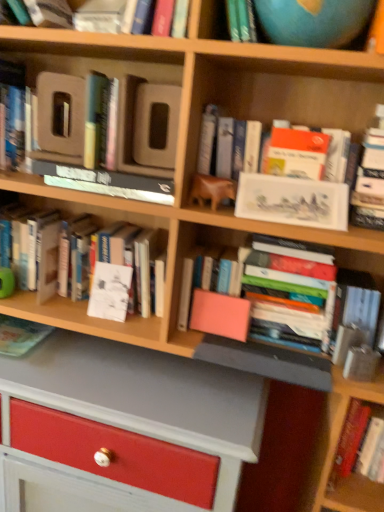
Question: Does hardcover book at lower right, the 1th book positioned from the bottom, have a smaller size compared to white paper at center, which is counted as the third paperback book, starting from the right?

Choices:
 (A) no
 (B) yes

Answer: (A)

Question: Is hardcover book at lower right, the 1th book positioned from the bottom, wider than white paper at center, arranged as the second paperback book when ordered from the bottom?

Choices:
 (A) yes
 (B) no

Answer: (A)

Question: Is the depth of hardcover book at lower right, which is counted as the 6th book, starting from the top, less than that of white paper at center, the 2th paperback book viewed from the top?

Choices:
 (A) yes
 (B) no

Answer: (A)

Question: From the image's perspective, would you say hardcover book at lower right, which is counted as the 6th book, starting from the top, is shown under white paper at center, arranged as the second paperback book when ordered from the bottom?

Choices:
 (A) no
 (B) yes

Answer: (B)

Question: Are hardcover book at lower right, the 1th book positioned from the bottom, and white paper at center, positioned as the 1th paperback book in back-to-front order, beside each other?

Choices:
 (A) yes
 (B) no

Answer: (B)

Question: In the image, is pink matte book at center, marked as the 3th paperback book in a top-to-bottom arrangement, positioned in front of or behind white glossy book at upper center, acting as the second book starting from the top?

Choices:
 (A) front
 (B) behind

Answer: (B)

Question: Is pink matte book at center, positioned as the second paperback book in front-to-back order, inside or outside of white glossy book at upper center, acting as the second book starting from the top?

Choices:
 (A) inside
 (B) outside

Answer: (B)

Question: From a real-world perspective, is pink matte book at center, the 2th paperback book in the left-to-right sequence, physically located above or below white glossy book at upper center, the 5th book when ordered from bottom to top?

Choices:
 (A) above
 (B) below

Answer: (B)

Question: In terms of height, does pink matte book at center, positioned as the second paperback book in front-to-back order, look taller or shorter compared to white glossy book at upper center, acting as the second book starting from the top?

Choices:
 (A) short
 (B) tall

Answer: (A)

Question: Is matte white painting at upper right, marked as the 3th paperback book in a bottom-to-top arrangement, taller or shorter than hardcover book at left, the 1th book positioned from the top?

Choices:
 (A) tall
 (B) short

Answer: (B)

Question: Choose the correct answer: Is matte white painting at upper right, which is the 1th paperback book in front-to-back order, inside hardcover book at left, the 1th book positioned from the top, or outside it?

Choices:
 (A) inside
 (B) outside

Answer: (B)

Question: Considering the positions of matte white painting at upper right, which is the first paperback book from right to left, and hardcover book at left, the 1th book positioned from the top, in the image, is matte white painting at upper right, which is the first paperback book from right to left, bigger or smaller than hardcover book at left, the 1th book positioned from the top,?

Choices:
 (A) big
 (B) small

Answer: (B)

Question: Is point (284, 179) closer or farther from the camera than point (13, 160)?

Choices:
 (A) farther
 (B) closer

Answer: (B)

Question: Is white paper at center, arranged as the 3th paperback book when viewed from the front, wider or thinner than hardcover book at lower right, the 1th book positioned from the bottom?

Choices:
 (A) wide
 (B) thin

Answer: (B)

Question: From their relative heights in the image, would you say white paper at center, which is counted as the third paperback book, starting from the right, is taller or shorter than hardcover book at lower right, which is counted as the 6th book, starting from the top?

Choices:
 (A) short
 (B) tall

Answer: (A)